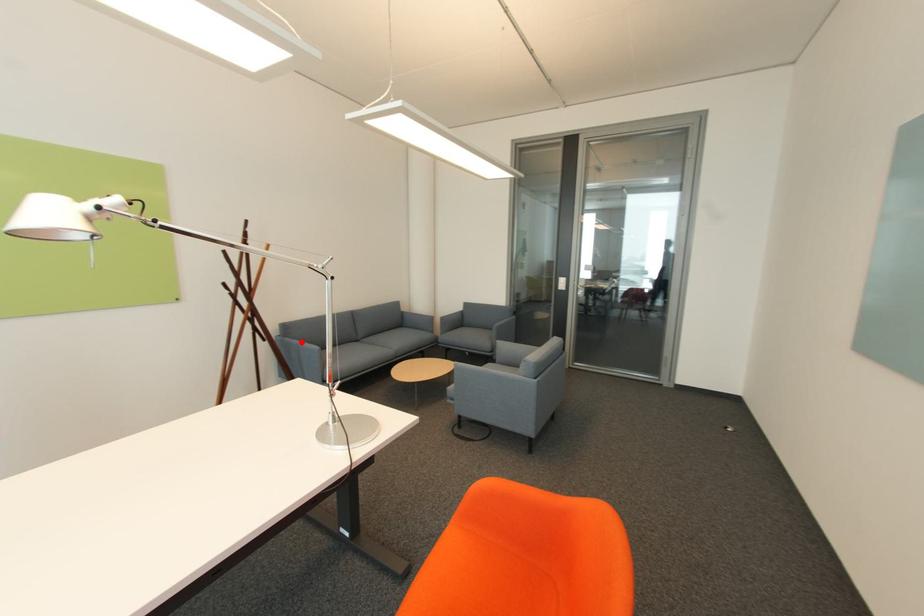
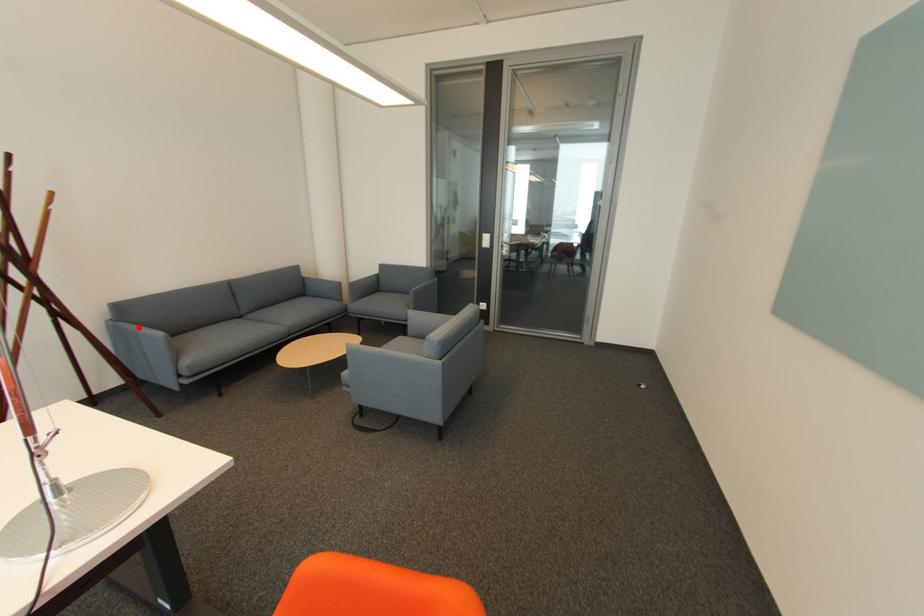
I am providing you with two images of the same scene from different viewpoints. A red point is marked on the first image and another point is marked on the second image. Are the points marked in image1 and image2 representing the same 3D position?

Yes